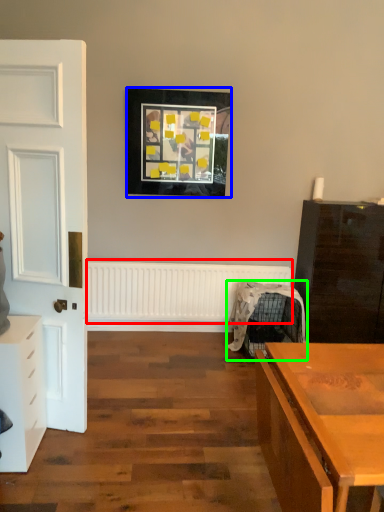
Question: Considering the real-world distances, which object is closest to radiator (highlighted by a red box)? picture frame (highlighted by a blue box) or swivel chair (highlighted by a green box).

Choices:
 (A) picture frame
 (B) swivel chair

Answer: (B)